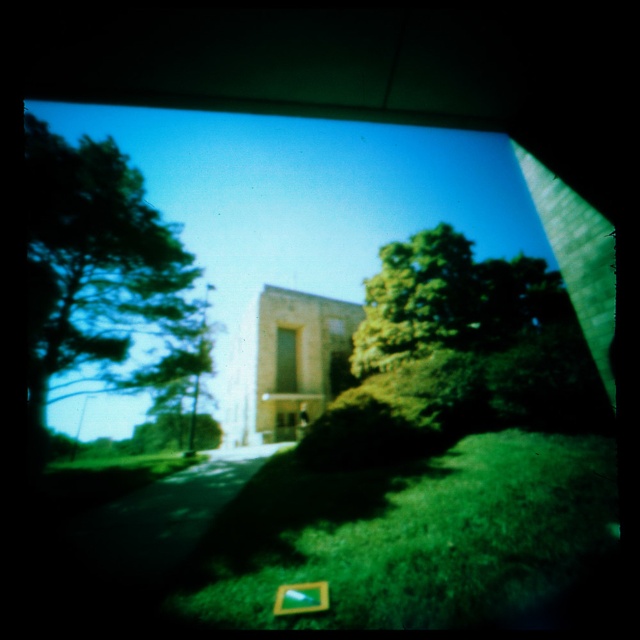
Question: Which of the following is the closest to the observer?

Choices:
 (A) [x=534, y=278]
 (B) [x=35, y=230]

Answer: (B)

Question: Does green leafy tree at left have a lesser width compared to green leafy tree at center?

Choices:
 (A) no
 (B) yes

Answer: (A)

Question: Which point is farther to the camera?

Choices:
 (A) (264, 561)
 (B) (440, 328)

Answer: (B)

Question: Is green grass at lower center positioned behind green leafy tree at left?

Choices:
 (A) no
 (B) yes

Answer: (A)

Question: Can you confirm if green grass at lower center is bigger than green leafy tree at center?

Choices:
 (A) yes
 (B) no

Answer: (B)

Question: Which of the following is the farthest from the observer?

Choices:
 (A) green leafy tree at center
 (B) green leafy tree at left
 (C) green grass at lower center

Answer: (A)